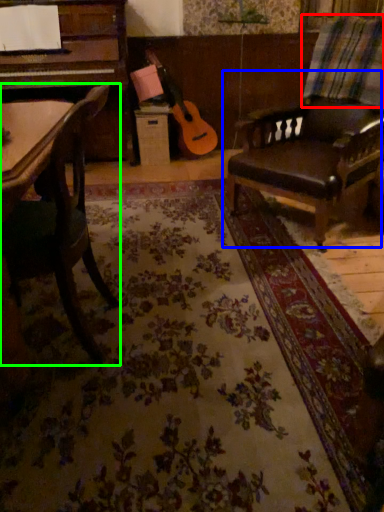
Question: Estimate the real-world distances between objects in this image. Which object is closer to plaid (highlighted by a red box), chair (highlighted by a blue box) or chair (highlighted by a green box)?

Choices:
 (A) chair
 (B) chair

Answer: (A)